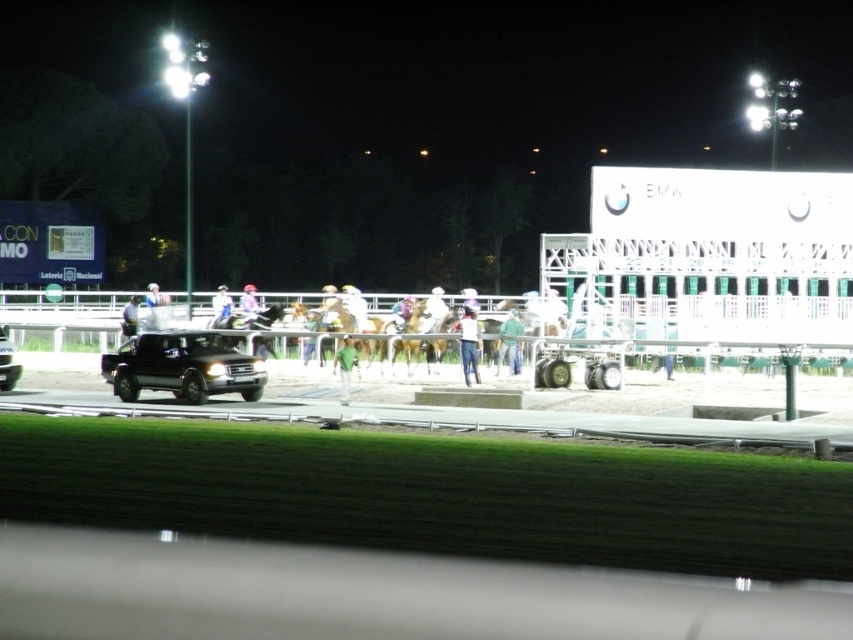
Which is below, white fabric helmet at center or light blue fabric jacket at center?

Positioned lower is light blue fabric jacket at center.

Is point (228, 321) less distant than point (135, 317)?

Yes, point (228, 321) is closer to viewer.

This screenshot has width=853, height=640. Describe the element at coordinates (221, 307) in the screenshot. I see `white fabric helmet at center` at that location.

Locate an element on the screen. The height and width of the screenshot is (640, 853). white fabric helmet at center is located at coordinates (221, 307).

Does point (503, 323) come farther from viewer compared to point (12, 342)?

No, (503, 323) is in front of (12, 342).

Can you confirm if green fabric jacket at center is smaller than black glossy suv at left?

Answer: Yes, green fabric jacket at center is smaller than black glossy suv at left.

Is point (514, 324) less distant than point (4, 365)?

No, (514, 324) is behind (4, 365).

Find the location of a particular element. This screenshot has width=853, height=640. green fabric jacket at center is located at coordinates click(509, 340).

Can you confirm if green fabric jacket at center is positioned above light blue fabric jacket at center?

Actually, green fabric jacket at center is below light blue fabric jacket at center.

Does green fabric jacket at center appear on the left side of light blue fabric jacket at center?

In fact, green fabric jacket at center is to the right of light blue fabric jacket at center.

Is point (498, 349) in front of point (122, 316)?

Yes, point (498, 349) is closer to viewer.

At what (x,y) coordinates should I click in order to perform the action: click on green fabric jacket at center. Please return your answer as a coordinate pair (x, y). The height and width of the screenshot is (640, 853). Looking at the image, I should click on (509, 340).